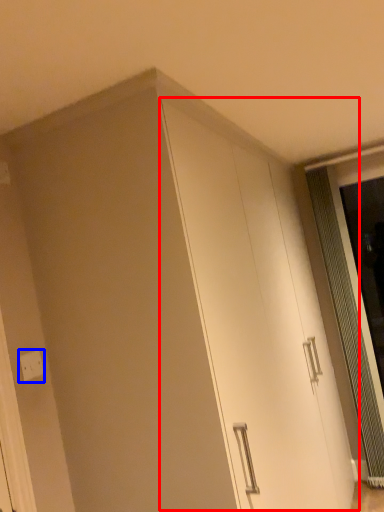
Question: Which of the following is the closest to the observer, cabinetry (highlighted by a red box) or electric outlet (highlighted by a blue box)?

Choices:
 (A) cabinetry
 (B) electric outlet

Answer: (A)